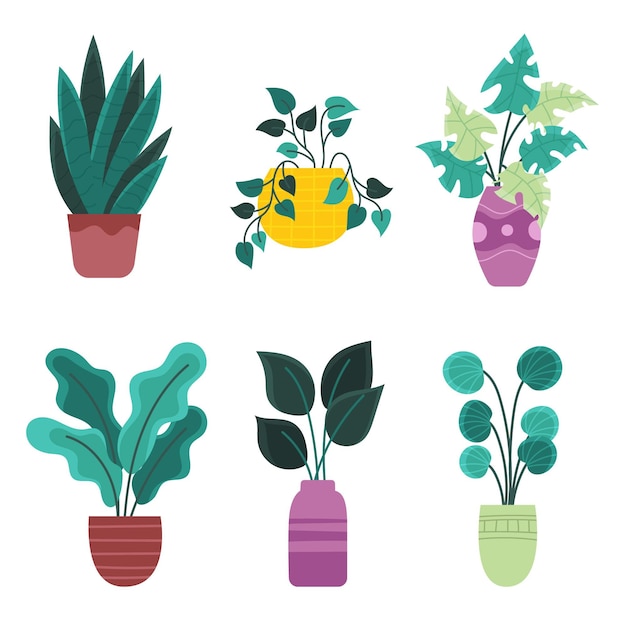
The width and height of the screenshot is (626, 626). What are the coordinates of `vases` in the screenshot? It's located at (129, 560), (111, 240), (325, 528), (500, 535), (516, 250), (299, 242).